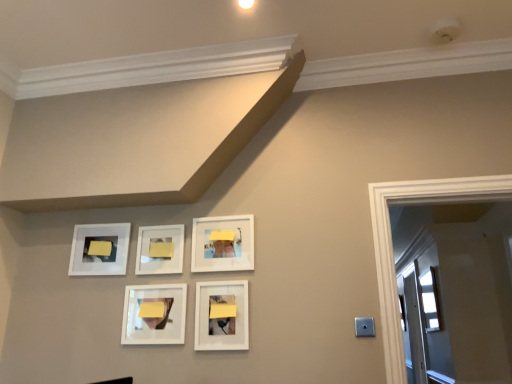
Question: Is white glossy picture frame at upper left, arranged as the 5th picture frame when viewed from the right, smaller than white matte picture frame at center, which is counted as the 3th picture frame, starting from the left?

Choices:
 (A) no
 (B) yes

Answer: (A)

Question: Can you confirm if white glossy picture frame at upper left, which is the 1th picture frame in left-to-right order, is bigger than white matte picture frame at center, the 3th picture frame positioned from the right?

Choices:
 (A) yes
 (B) no

Answer: (A)

Question: Is white glossy picture frame at upper left, arranged as the 5th picture frame when viewed from the right, facing away from white matte picture frame at center, the 3th picture frame positioned from the right?

Choices:
 (A) yes
 (B) no

Answer: (B)

Question: Is white glossy picture frame at upper left, arranged as the 5th picture frame when viewed from the right, outside of white matte picture frame at center, which is counted as the 3th picture frame, starting from the left?

Choices:
 (A) yes
 (B) no

Answer: (A)

Question: From the image's perspective, is white glossy picture frame at upper left, which is the 1th picture frame in left-to-right order, above white matte picture frame at center, which is counted as the 3th picture frame, starting from the left?

Choices:
 (A) yes
 (B) no

Answer: (B)

Question: Is white glossy picture frame at upper left, arranged as the 5th picture frame when viewed from the right, next to white matte picture frame at center, which is counted as the 3th picture frame, starting from the left, and touching it?

Choices:
 (A) yes
 (B) no

Answer: (B)

Question: Is white glossy picture frame at upper left, which is the 1th picture frame in left-to-right order, far from matte white picture frame at lower center, arranged as the 5th picture frame when viewed from the left?

Choices:
 (A) no
 (B) yes

Answer: (A)

Question: Is matte white picture frame at lower center, arranged as the 5th picture frame when viewed from the left, completely or partially inside white glossy picture frame at upper left, arranged as the 5th picture frame when viewed from the right?

Choices:
 (A) yes
 (B) no

Answer: (B)

Question: From the image's perspective, is white glossy picture frame at upper left, arranged as the 5th picture frame when viewed from the right, over matte white picture frame at lower center, which is counted as the first picture frame, starting from the right?

Choices:
 (A) yes
 (B) no

Answer: (A)

Question: Is white glossy picture frame at upper left, which is the 1th picture frame in left-to-right order, completely or partially outside of matte white picture frame at lower center, which is counted as the first picture frame, starting from the right?

Choices:
 (A) no
 (B) yes

Answer: (B)

Question: Is white glossy picture frame at upper left, arranged as the 5th picture frame when viewed from the right, oriented away from matte white picture frame at lower center, which is counted as the first picture frame, starting from the right?

Choices:
 (A) no
 (B) yes

Answer: (A)

Question: Considering the relative sizes of white glossy picture frame at upper left, which is the 1th picture frame in left-to-right order, and matte white picture frame at lower center, arranged as the 5th picture frame when viewed from the left, in the image provided, is white glossy picture frame at upper left, which is the 1th picture frame in left-to-right order, smaller than matte white picture frame at lower center, arranged as the 5th picture frame when viewed from the left,?

Choices:
 (A) no
 (B) yes

Answer: (B)

Question: From a real-world perspective, is matte white picture frame at lower center, which is counted as the first picture frame, starting from the right, on white matte picture frame at center, the 3th picture frame positioned from the right?

Choices:
 (A) yes
 (B) no

Answer: (B)